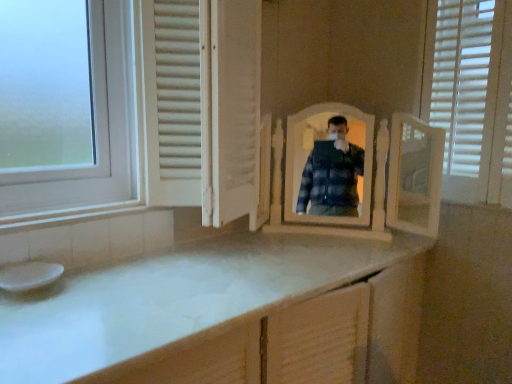
Question: Is white matte screen door at center aimed at white glossy sink at lower left?

Choices:
 (A) yes
 (B) no

Answer: (B)

Question: From a real-world perspective, is white matte screen door at center on top of white glossy sink at lower left?

Choices:
 (A) yes
 (B) no

Answer: (A)

Question: Is the depth of white matte screen door at center greater than that of white glossy sink at lower left?

Choices:
 (A) no
 (B) yes

Answer: (A)

Question: From the image's perspective, does white matte screen door at center appear lower than white glossy sink at lower left?

Choices:
 (A) no
 (B) yes

Answer: (A)

Question: Does white matte screen door at center have a greater width compared to white glossy sink at lower left?

Choices:
 (A) no
 (B) yes

Answer: (B)

Question: From the image's perspective, is white matte screen door at center above white glossy sink at lower left?

Choices:
 (A) no
 (B) yes

Answer: (B)

Question: Can you confirm if white matte screen door at center is shorter than white wooden mirror at center?

Choices:
 (A) no
 (B) yes

Answer: (A)

Question: Can you confirm if white matte screen door at center is bigger than white wooden mirror at center?

Choices:
 (A) yes
 (B) no

Answer: (B)

Question: Does white matte screen door at center have a smaller size compared to white wooden mirror at center?

Choices:
 (A) yes
 (B) no

Answer: (A)

Question: Would you say white matte screen door at center is outside white wooden mirror at center?

Choices:
 (A) no
 (B) yes

Answer: (B)

Question: Is white matte screen door at center aimed at white wooden mirror at center?

Choices:
 (A) no
 (B) yes

Answer: (A)

Question: From a real-world perspective, is white matte screen door at center physically below white wooden mirror at center?

Choices:
 (A) no
 (B) yes

Answer: (A)

Question: Does white glossy sink at lower left have a greater width compared to white wooden mirror at center?

Choices:
 (A) no
 (B) yes

Answer: (A)